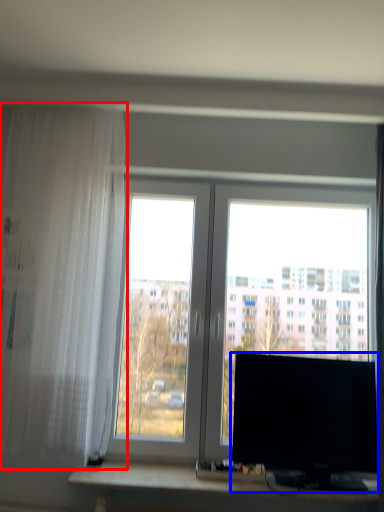
Question: Which object is closer to the camera taking this photo, curtain (highlighted by a red box) or computer monitor (highlighted by a blue box)?

Choices:
 (A) curtain
 (B) computer monitor

Answer: (A)